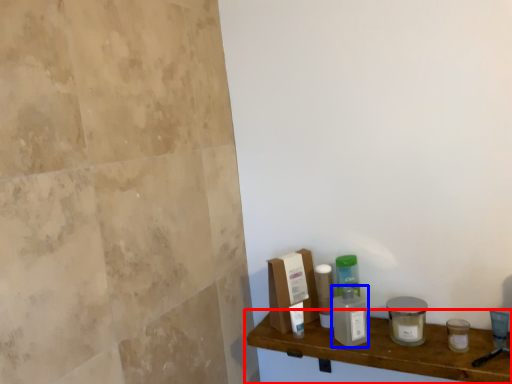
Question: Which object appears farthest to the camera in this image, shelf (highlighted by a red box) or cleaning product (highlighted by a blue box)?

Choices:
 (A) shelf
 (B) cleaning product

Answer: (B)